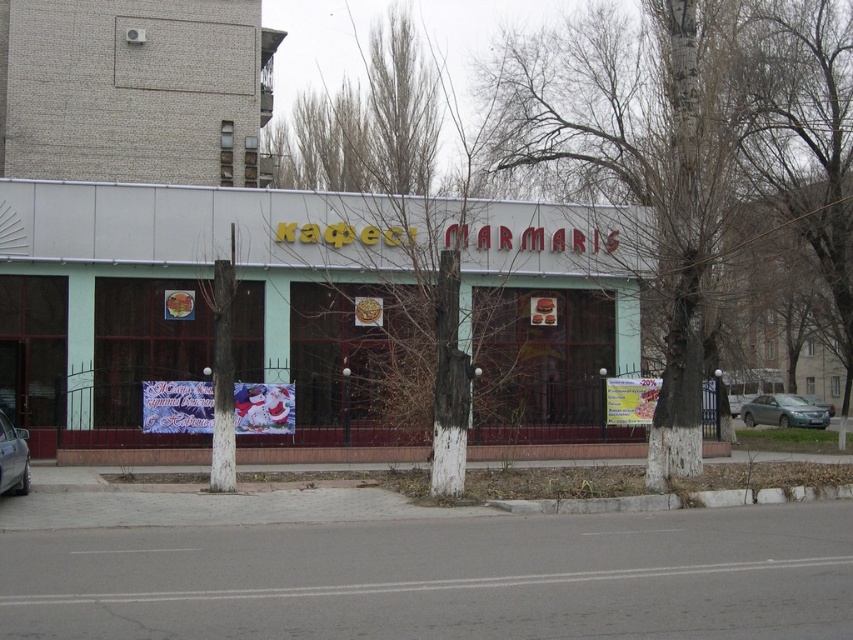
Is point (824, 422) closer to viewer compared to point (0, 486)?

No, (824, 422) is further to viewer.

Which is behind, point (820, 419) or point (19, 483)?

The point (820, 419) is behind.

Is point (798, 420) farther from viewer compared to point (0, 472)?

That is True.

Where is `satin silver sedan at right`? This screenshot has height=640, width=853. satin silver sedan at right is located at coordinates click(x=782, y=412).

Can you confirm if silver metallic car at lower left is shorter than silver metallic sedan at center?

Incorrect, silver metallic car at lower left's height does not fall short of silver metallic sedan at center's.

Between silver metallic car at lower left and silver metallic sedan at center, which one has more height?

silver metallic car at lower left is taller.

Between point (4, 422) and point (809, 403), which one is positioned behind?

The point (809, 403) is behind.

Identify the location of silver metallic car at lower left. This screenshot has width=853, height=640. (13, 458).

Which is in front, point (389, 323) or point (18, 428)?

Point (389, 323)

Consider the image. Does green matte building at center lie behind silver metallic car at lower left?

Yes, green matte building at center is behind silver metallic car at lower left.

Between point (606, 339) and point (16, 460), which one is positioned in front?

Positioned in front is point (16, 460).

Identify the location of green matte building at center. The width and height of the screenshot is (853, 640). (306, 301).